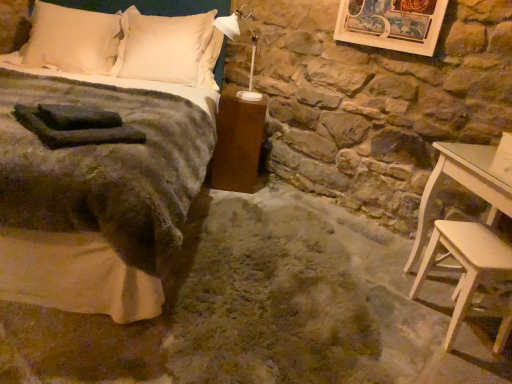
Question: Considering the positions of velvet green blanket at left and light beige wood stool at lower right in the image, is velvet green blanket at left taller or shorter than light beige wood stool at lower right?

Choices:
 (A) tall
 (B) short

Answer: (A)

Question: Considering the positions of velvet green blanket at left and light beige wood stool at lower right in the image, is velvet green blanket at left bigger or smaller than light beige wood stool at lower right?

Choices:
 (A) big
 (B) small

Answer: (A)

Question: Which is nearer to the white soft pillow at upper left, which is counted as the 1th pillow, starting from the left?

Choices:
 (A) light beige wood stool at lower right
 (B) satin white pillow at upper center, the first pillow from the right
 (C) brown matte nightstand at lower center
 (D) velvet green blanket at left

Answer: (B)

Question: Which is nearer to the brown matte nightstand at lower center?

Choices:
 (A) satin white pillow at upper center, the 2th pillow in the left-to-right sequence
 (B) velvet green blanket at left
 (C) light beige wood stool at lower right
 (D) white soft pillow at upper left, which is counted as the 1th pillow, starting from the left

Answer: (A)